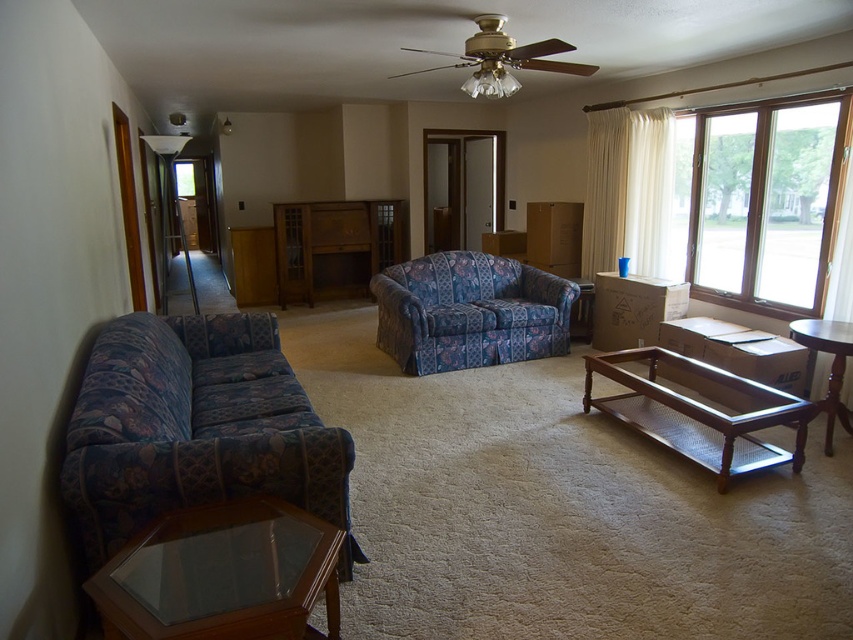
Question: Which of the following is the closest to the observer?

Choices:
 (A) (190, 404)
 (B) (837, 378)
 (C) (590, 310)
 (D) (498, 308)

Answer: (A)

Question: Is floral fabric couch at center thinner than brown wooden table at lower right?

Choices:
 (A) yes
 (B) no

Answer: (B)

Question: Considering the real-world distances, which object is closest to the floral fabric couch at center?

Choices:
 (A) floral fabric couch at left
 (B) clear glass coffee table at center
 (C) brown wood/metal mesh coffee table at center
 (D) transparent glass coffee table at lower left

Answer: (B)

Question: Which of the following is the farthest from the observer?

Choices:
 (A) transparent glass coffee table at lower left
 (B) floral fabric couch at center
 (C) clear glass coffee table at center

Answer: (C)

Question: Can you confirm if floral fabric couch at left is smaller than brown wood window at upper right?

Choices:
 (A) no
 (B) yes

Answer: (A)

Question: Is floral fabric couch at left closer to camera compared to floral fabric couch at center?

Choices:
 (A) no
 (B) yes

Answer: (B)